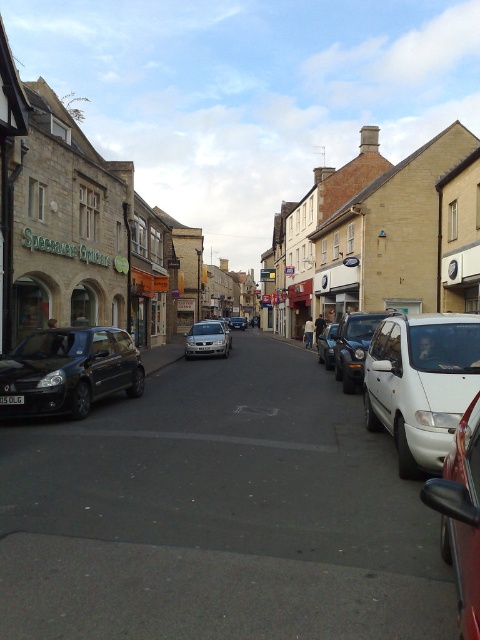
You are standing at the center of the street and want to cross to the other side. There is a white matte van at right represented by point (420,384). Where should you avoid stepping to ensure safety?

You should avoid stepping near the white matte van at right represented by point (420,384) because it is located on the right side of the street where vehicles are parked and driving, posing a potential hazard.

You are a pedestrian standing on the street and want to cross from the left side to the right side. The white matte van at right and the white matte van at center are blocking your path. Which van should you move around to safely cross the street?

You should move around the white matte van at right because it is positioned lower on the street and closer to your starting point on the left side, allowing for a safer crossing path.

You are a delivery driver who needs to park your white matte van at right in a parking spot that can only accommodate vehicles smaller than the silver metallic car at center. Is your van suitable for this parking spot?

The white matte van at right is smaller than the silver metallic car at center, so it is suitable for the parking spot that requires vehicles smaller than the silver metallic car at center.